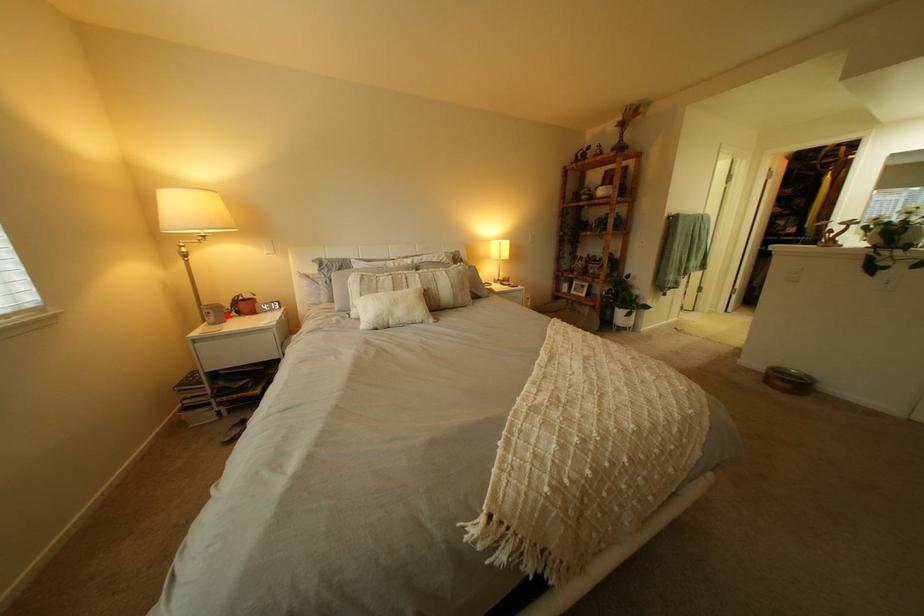
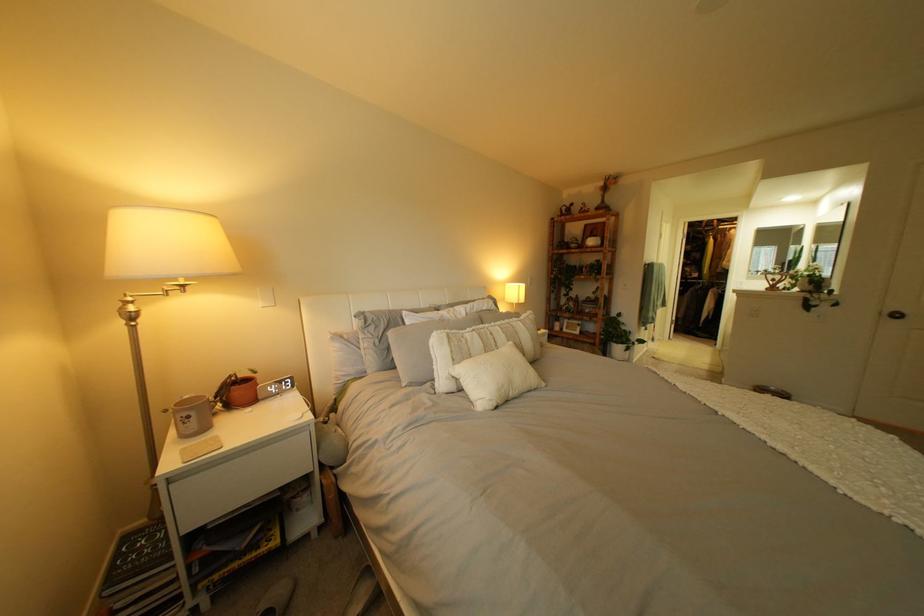
Find the pixel in the second image that matches the highlighted location in the first image.

(209, 419)